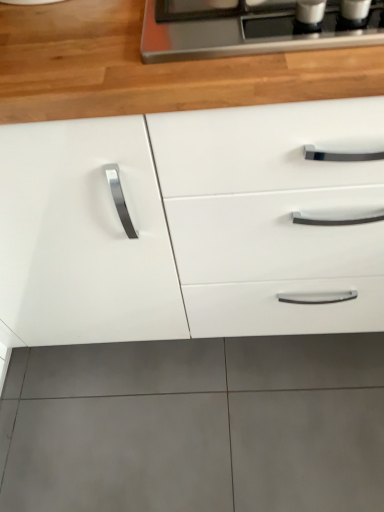
Question: Is point (294, 87) closer or farther from the camera than point (203, 110)?

Choices:
 (A) farther
 (B) closer

Answer: (B)

Question: From the image's perspective, is wooden at upper center positioned above or below white glossy cabinet at center?

Choices:
 (A) below
 (B) above

Answer: (B)

Question: Based on their sizes in the image, would you say wooden at upper center is bigger or smaller than white glossy cabinet at center?

Choices:
 (A) small
 (B) big

Answer: (A)

Question: Considering the relative positions of white glossy cabinet at center and wooden at upper center in the image provided, is white glossy cabinet at center to the left or to the right of wooden at upper center?

Choices:
 (A) left
 (B) right

Answer: (A)

Question: Is point click(x=241, y=321) closer or farther from the camera than point click(x=102, y=53)?

Choices:
 (A) farther
 (B) closer

Answer: (A)

Question: In terms of size, does white glossy cabinet at center appear bigger or smaller than wooden at upper center?

Choices:
 (A) small
 (B) big

Answer: (B)

Question: From a real-world perspective, is white glossy cabinet at center above or below wooden at upper center?

Choices:
 (A) below
 (B) above

Answer: (A)